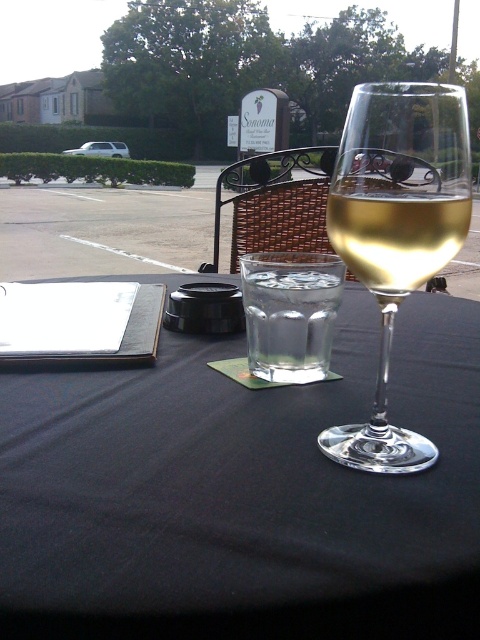
Which is behind, point (402, 227) or point (372, 211)?

The point (372, 211) is more distant.

Does clear glass wine glass at center appear on the left side of clear glass wine at center?

Indeed, clear glass wine glass at center is positioned on the left side of clear glass wine at center.

Identify the location of clear glass wine glass at center. (396, 232).

This screenshot has height=640, width=480. Find the location of `clear glass wine glass at center`. clear glass wine glass at center is located at coordinates pyautogui.click(x=396, y=232).

Is clear glass table at center positioned in front of clear glass wine at center?

Yes, it is.

Can you confirm if clear glass table at center is positioned to the right of clear glass wine at center?

Incorrect, clear glass table at center is not on the right side of clear glass wine at center.

Image resolution: width=480 pixels, height=640 pixels. What do you see at coordinates (242, 493) in the screenshot?
I see `clear glass table at center` at bounding box center [242, 493].

Identify the location of clear glass table at center. pos(242,493).

Who is shorter, clear glass table at center or clear glass wine glass at center?

clear glass table at center is shorter.

Does clear glass table at center have a greater height compared to clear glass wine glass at center?

No, clear glass table at center is not taller than clear glass wine glass at center.

Is point (396, 554) more distant than point (407, 273)?

No, it is not.

The height and width of the screenshot is (640, 480). Find the location of `clear glass table at center`. clear glass table at center is located at coordinates (242, 493).